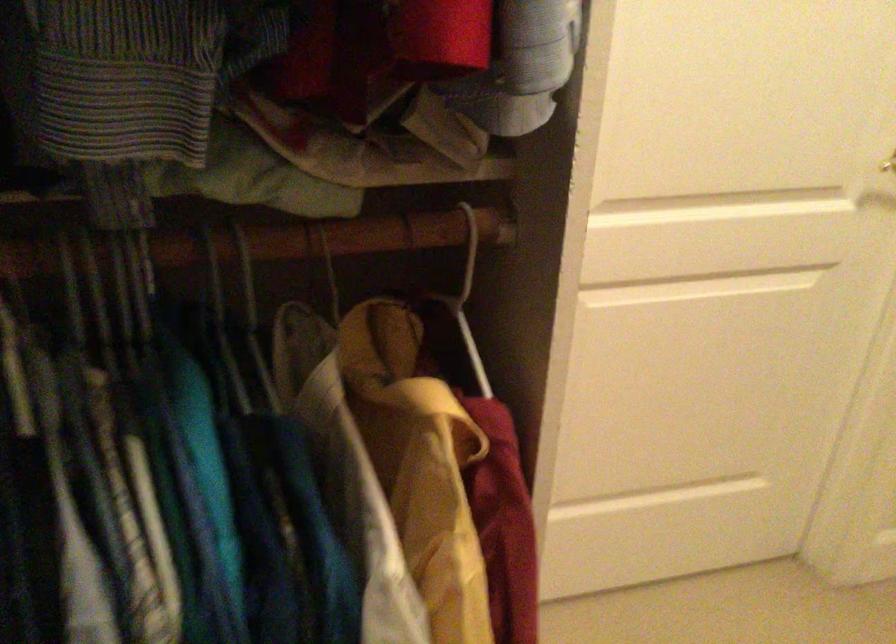
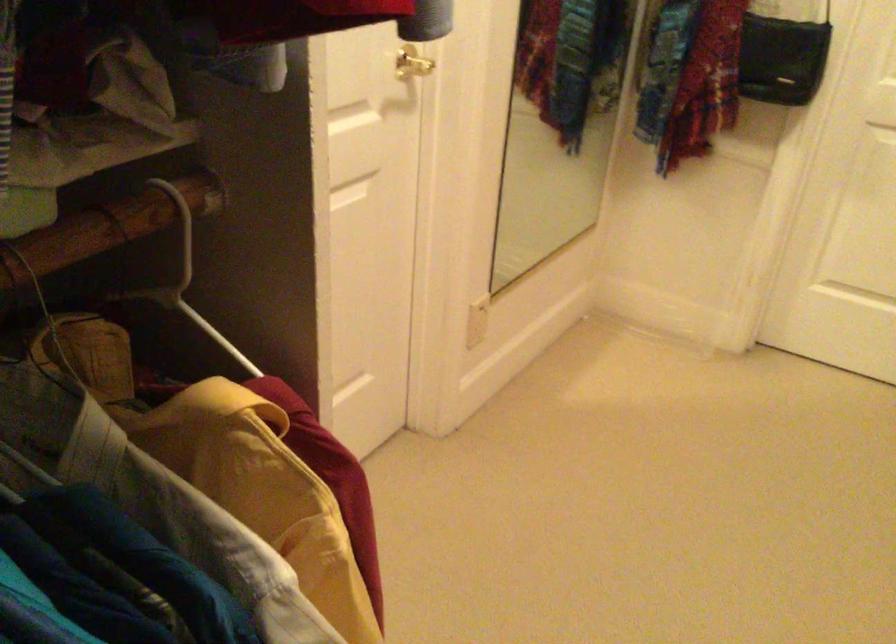
Question: Based on the continuous images, in which direction is the camera rotating? Reply with the corresponding letter.

Choices:
 (A) Left
 (B) Right
 (C) Up
 (D) Down

Answer: (B)